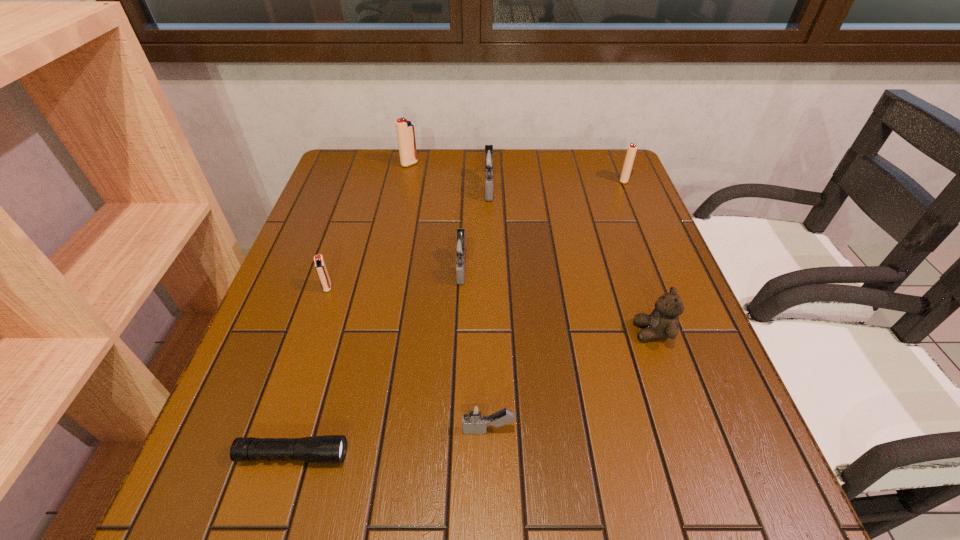
Where is `vacant space located 0.300m on the face of the sixth farthest object`? vacant space located 0.300m on the face of the sixth farthest object is located at coordinates (488, 332).

This screenshot has height=540, width=960. In order to click on free location located on the front of the leftmost igniter in this screenshot , I will do `click(270, 457)`.

Identify the location of free space located on the left of the nearest igniter. This screenshot has width=960, height=540. (311, 430).

In order to click on vacant position located at the lens end of the black flashlight in this screenshot , I will do `click(479, 455)`.

Identify the location of igniter that is at the left edge. The height and width of the screenshot is (540, 960). click(320, 266).

Locate an element on the screen. flashlight that is at the left edge is located at coordinates (330, 449).

This screenshot has height=540, width=960. I want to click on igniter located at the right edge, so click(x=631, y=151).

Where is `teddy bear present at the right edge`? The image size is (960, 540). teddy bear present at the right edge is located at coordinates (663, 322).

Locate an element on the screen. This screenshot has width=960, height=540. object that is positioned at the far right corner is located at coordinates (631, 151).

Find the location of `free region at the far edge`. free region at the far edge is located at coordinates (512, 158).